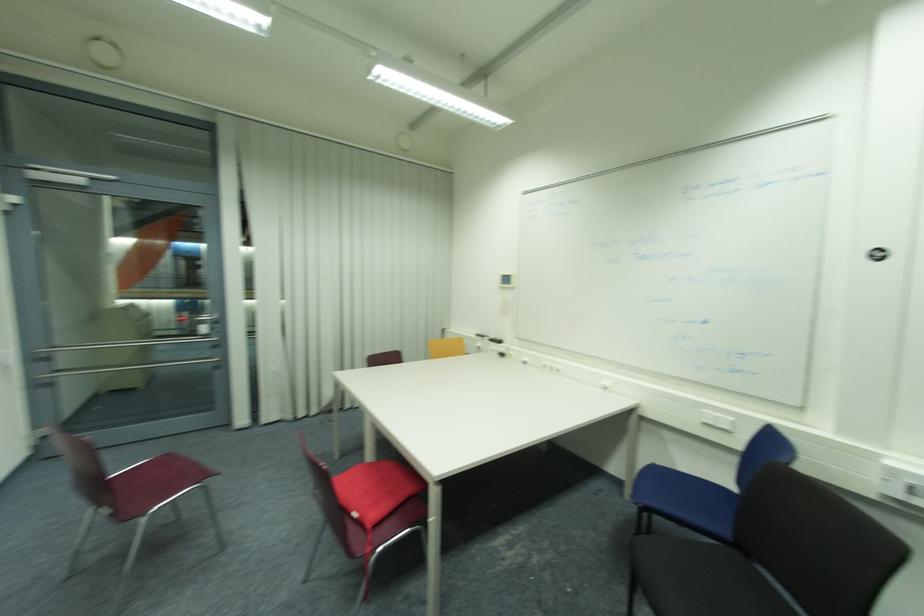
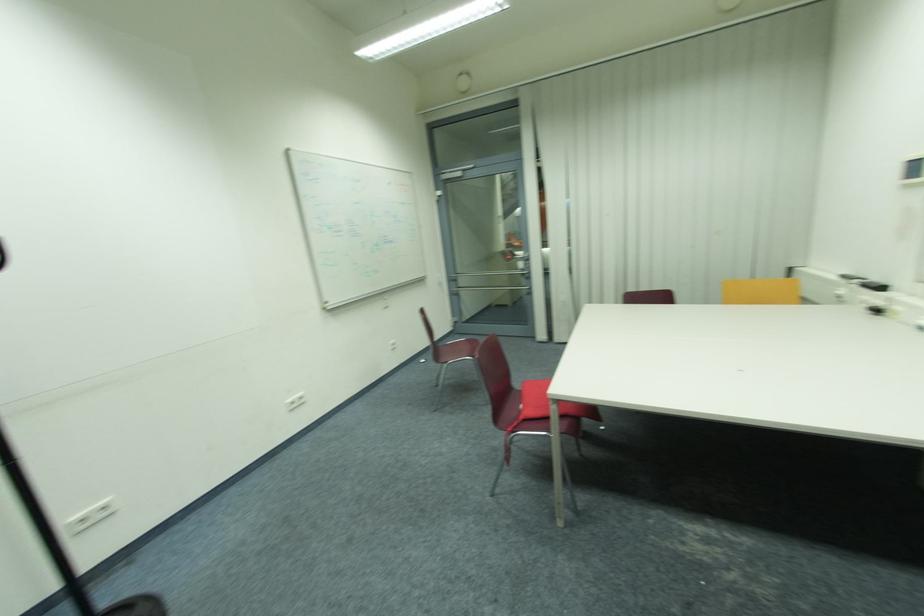
Question: The camera is either moving clockwise (left) or counter-clockwise (right) around the object. The first image is from the beginning of the video and the second image is from the end. Is the camera moving left or right when shooting the video?

Choices:
 (A) Left
 (B) Right

Answer: (B)